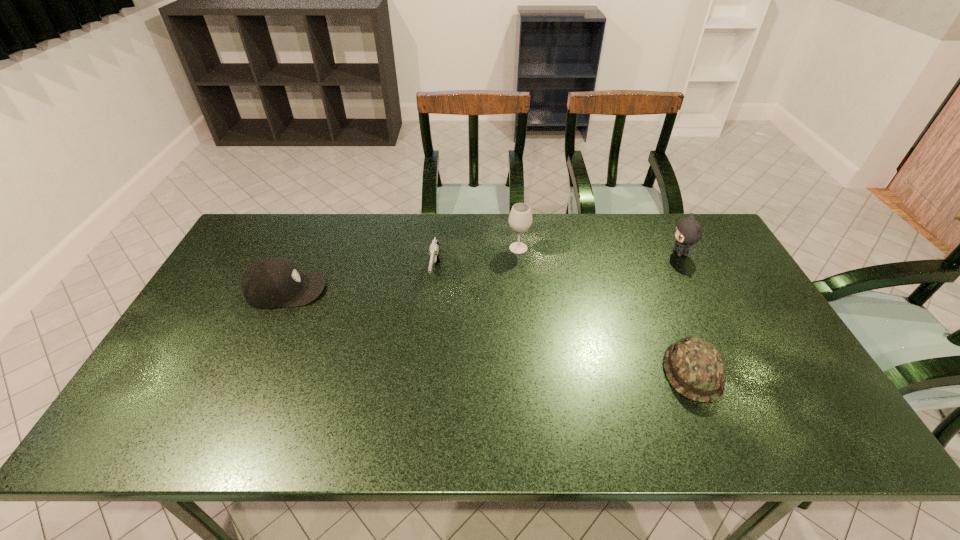
At what (x,y) coordinates should I click in order to perform the action: click on blank space located 0.100m on the front-facing side of the rightmost object. Please return your answer as a coordinate pair (x, y). This screenshot has height=540, width=960. Looking at the image, I should click on (638, 253).

Identify the location of free space located on the front-facing side of the rightmost object. (613, 253).

Locate an element on the screen. The width and height of the screenshot is (960, 540). vacant space located at the muzzle of the gun is located at coordinates (424, 375).

Where is `vacant space situated on the front-facing side of the farther headwear`? vacant space situated on the front-facing side of the farther headwear is located at coordinates (366, 289).

Image resolution: width=960 pixels, height=540 pixels. Find the location of `vacant space situated on the left of the nearest object`. vacant space situated on the left of the nearest object is located at coordinates (560, 372).

Find the location of a particular element. Image resolution: width=960 pixels, height=540 pixels. wineglass that is at the far edge is located at coordinates (520, 219).

Image resolution: width=960 pixels, height=540 pixels. What are the coordinates of `kitten present at the far edge` in the screenshot? It's located at coord(688,231).

Identify the location of gun at the far edge. The height and width of the screenshot is (540, 960). (434, 250).

Where is `object at the left edge`? This screenshot has width=960, height=540. object at the left edge is located at coordinates (270, 282).

Locate an element on the screen. The height and width of the screenshot is (540, 960). object that is at the right edge is located at coordinates (688, 231).